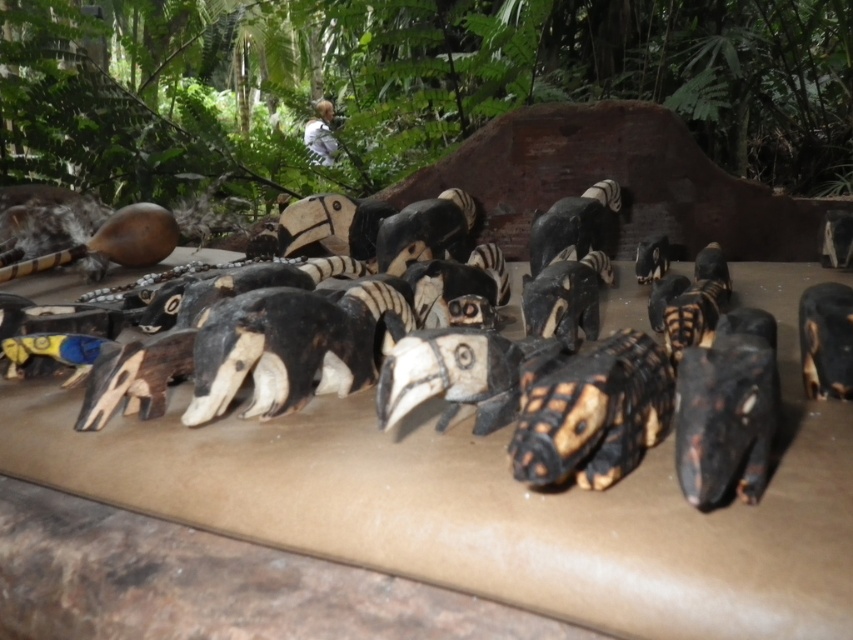
Question: Which point is closer to the camera?

Choices:
 (A) (804, 360)
 (B) (766, 499)

Answer: (B)

Question: Observing the image, what is the correct spatial positioning of black wood animal at center in reference to black matte hornbill head at lower right?

Choices:
 (A) right
 (B) left

Answer: (B)

Question: Does black wood animal at center appear on the right side of black matte hornbill head at lower right?

Choices:
 (A) yes
 (B) no

Answer: (B)

Question: Which of the following is the closest to the observer?

Choices:
 (A) pos(837,333)
 (B) pos(318,504)

Answer: (B)

Question: Is black wood animal at center above black matte hornbill head at lower right?

Choices:
 (A) yes
 (B) no

Answer: (B)